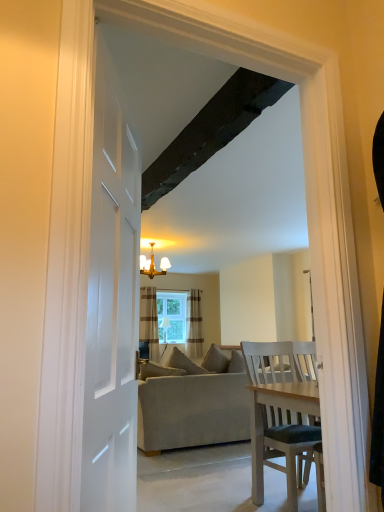
Question: Considering the positions of clear glass window at center and gold metallic chandelier at upper center in the image, is clear glass window at center taller or shorter than gold metallic chandelier at upper center?

Choices:
 (A) tall
 (B) short

Answer: (A)

Question: In the image, is clear glass window at center on the left side or the right side of gold metallic chandelier at upper center?

Choices:
 (A) left
 (B) right

Answer: (B)

Question: Estimate the real-world distances between objects in this image. Which object is farther from the striped fabric curtain at center, which ranks as the 2th curtain in left-to-right order?

Choices:
 (A) dark wood beam at upper center
 (B) gold metallic chandelier at upper center
 (C) beige fabric couch at center
 (D) clear glass window at center
 (E) brown striped curtain at center, the first curtain from the left

Answer: (A)

Question: Based on their relative distances, which object is farther from the beige fabric couch at center?

Choices:
 (A) clear glass window at center
 (B) striped fabric curtain at center, which ranks as the 2th curtain in left-to-right order
 (C) dark wood beam at upper center
 (D) gold metallic chandelier at upper center
 (E) brown striped curtain at center, the first curtain from the left

Answer: (A)